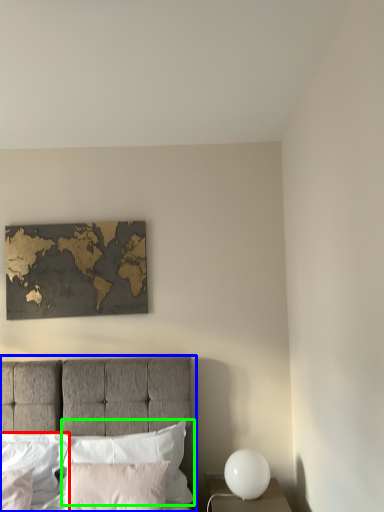
Question: Considering the real-world distances, which object is farthest from pillow (highlighted by a red box)? bed (highlighted by a blue box) or pillow (highlighted by a green box)?

Choices:
 (A) bed
 (B) pillow

Answer: (A)